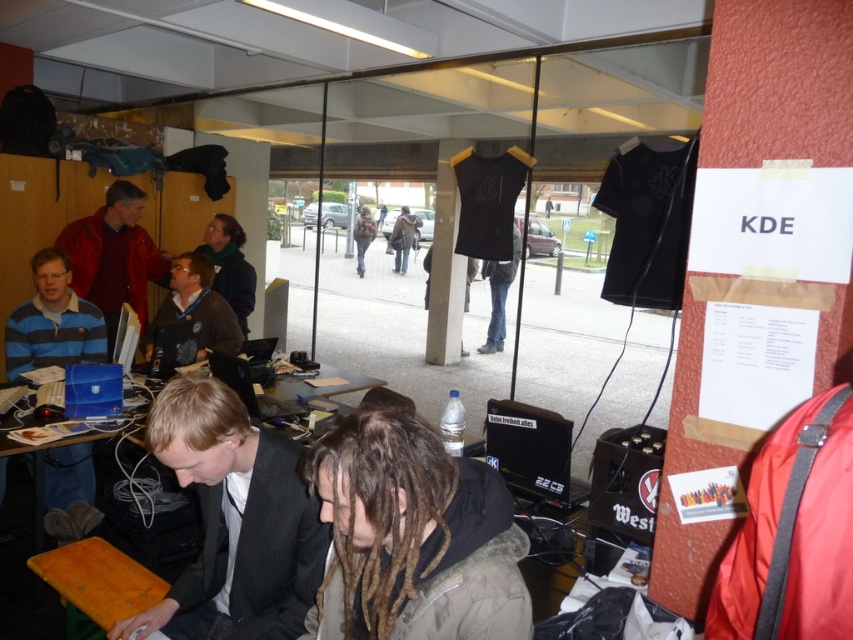
Question: Can you confirm if dark gray suit at center is thinner than dark gray hoodie at center?

Choices:
 (A) no
 (B) yes

Answer: (A)

Question: Is brown fuzzy jacket at lower center positioned in front of dark brown leather jacket at center?

Choices:
 (A) yes
 (B) no

Answer: (A)

Question: Which object appears closest to the camera in this image?

Choices:
 (A) dark gray suit at center
 (B) matte brown jacket at center
 (C) matte red jacket at center
 (D) dark gray hoodie at center

Answer: (A)

Question: Which point is closer to the camera?

Choices:
 (A) dark gray hoodie at center
 (B) wooden table at center

Answer: (B)

Question: Does matte brown jacket at center appear on the right side of dark brown leather jacket at center?

Choices:
 (A) no
 (B) yes

Answer: (B)

Question: Which point appears closest to the camera in this image?

Choices:
 (A) (88, 221)
 (B) (173, 396)
 (C) (340, 371)

Answer: (B)